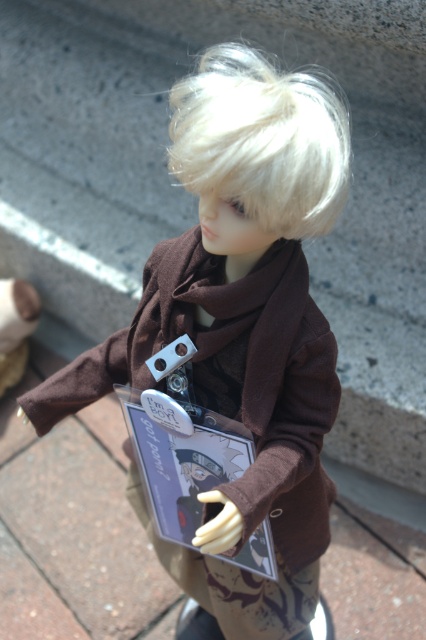
Question: Which object is positioned closest to the matte brown scarf at center?

Choices:
 (A) blonde silky hair at center
 (B) brown soft scarf at center
 (C) matte brown doll at center

Answer: (B)

Question: Does blonde silky hair at center lie in front of brown soft scarf at center?

Choices:
 (A) no
 (B) yes

Answer: (B)

Question: Which of the following is the closest to the observer?

Choices:
 (A) brown soft scarf at center
 (B) matte brown doll at center

Answer: (A)

Question: Which of the following is the farthest from the observer?

Choices:
 (A) (20, 324)
 (B) (293, 262)
 (C) (146, 356)
 (D) (244, 188)

Answer: (A)

Question: Can you confirm if blonde silky hair at center is positioned below brown soft scarf at center?

Choices:
 (A) yes
 (B) no

Answer: (B)

Question: Does matte brown scarf at center have a greater width compared to blonde silky hair at center?

Choices:
 (A) yes
 (B) no

Answer: (A)